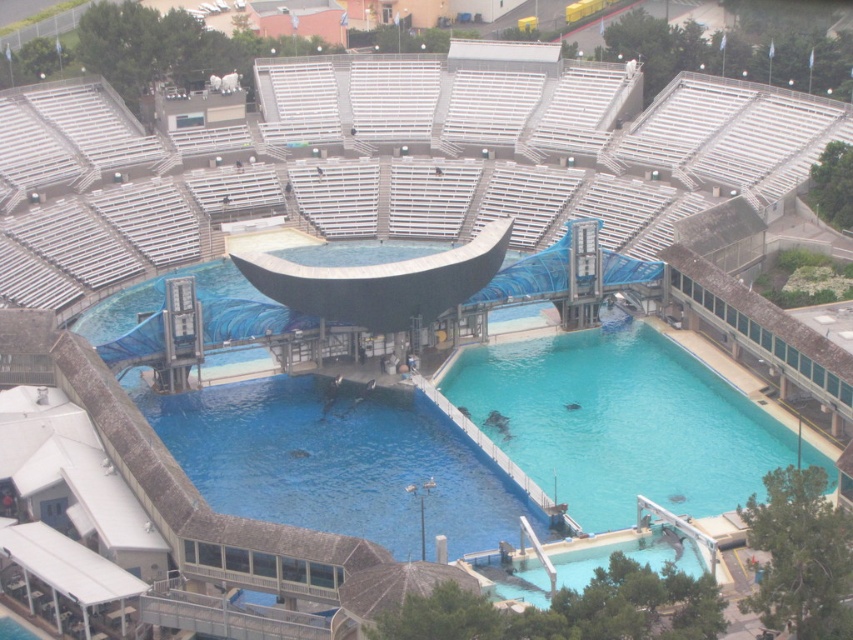
Question: Is clear blue water at center in front of blue smooth water at center?

Choices:
 (A) yes
 (B) no

Answer: (B)

Question: Among these points, which one is nearest to the camera?

Choices:
 (A) tap(691, 509)
 (B) tap(357, 499)

Answer: (A)

Question: Considering the relative positions of clear blue water at center and blue smooth water at center in the image provided, where is clear blue water at center located with respect to blue smooth water at center?

Choices:
 (A) above
 (B) below

Answer: (A)

Question: Which point appears closest to the camera in this image?

Choices:
 (A) (524, 506)
 (B) (643, 465)

Answer: (A)

Question: Is clear blue water at center above blue smooth water at center?

Choices:
 (A) yes
 (B) no

Answer: (A)